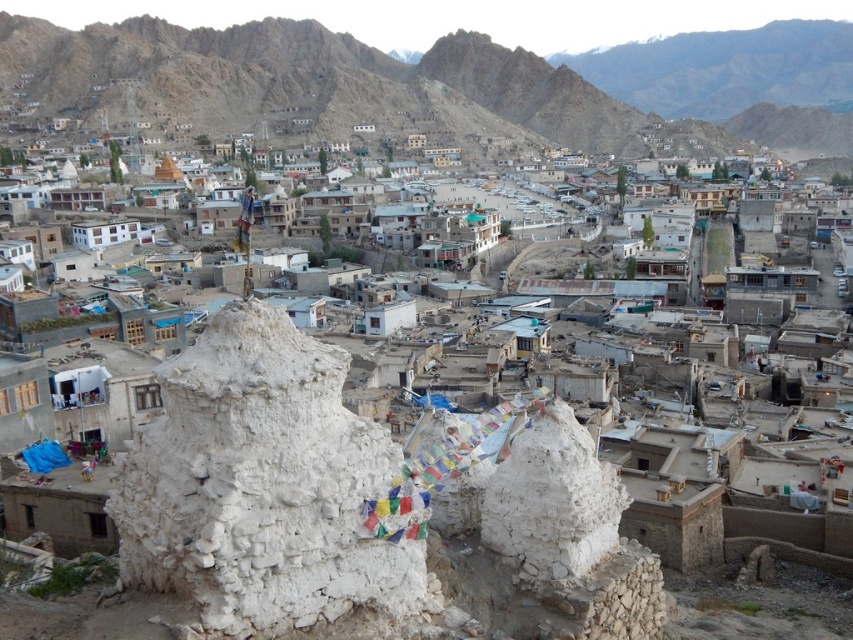
Question: Does white clay stupa at center have a greater width compared to white stone ruins at center?

Choices:
 (A) yes
 (B) no

Answer: (B)

Question: Can you confirm if rugged stone mountain at upper center is thinner than white stone ruins at center?

Choices:
 (A) no
 (B) yes

Answer: (A)

Question: Is rugged stone mountain at upper center positioned behind white stone ruins at center?

Choices:
 (A) no
 (B) yes

Answer: (B)

Question: Which point appears farthest from the camera in this image?

Choices:
 (A) (254, 604)
 (B) (27, 33)
 (C) (715, 497)

Answer: (B)

Question: Which point is farther from the camera taking this photo?

Choices:
 (A) (498, 106)
 (B) (601, 378)

Answer: (A)

Question: Estimate the real-world distances between objects in this image. Which object is closer to the rugged stone mountain at upper center?

Choices:
 (A) white stone ruins at center
 (B) white clay stupa at center

Answer: (A)